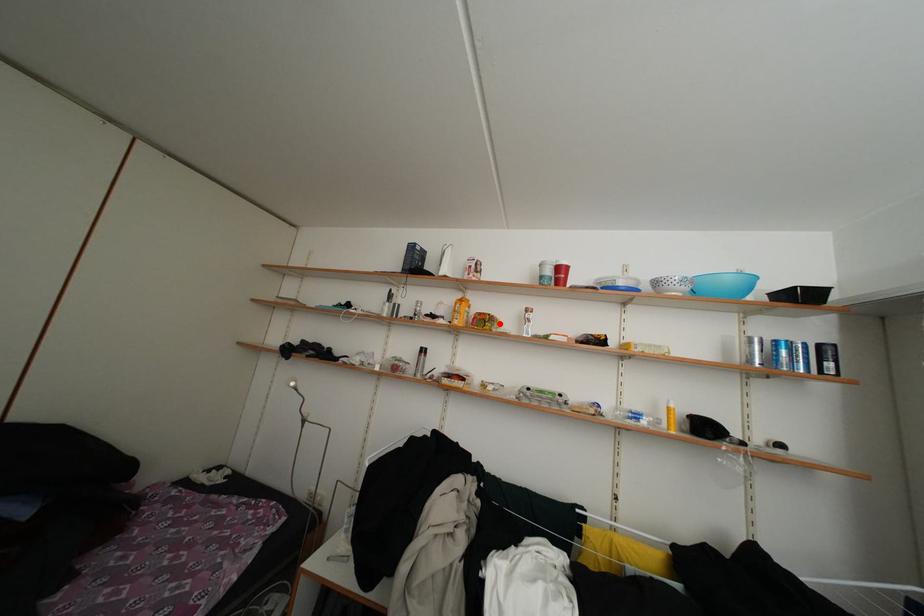
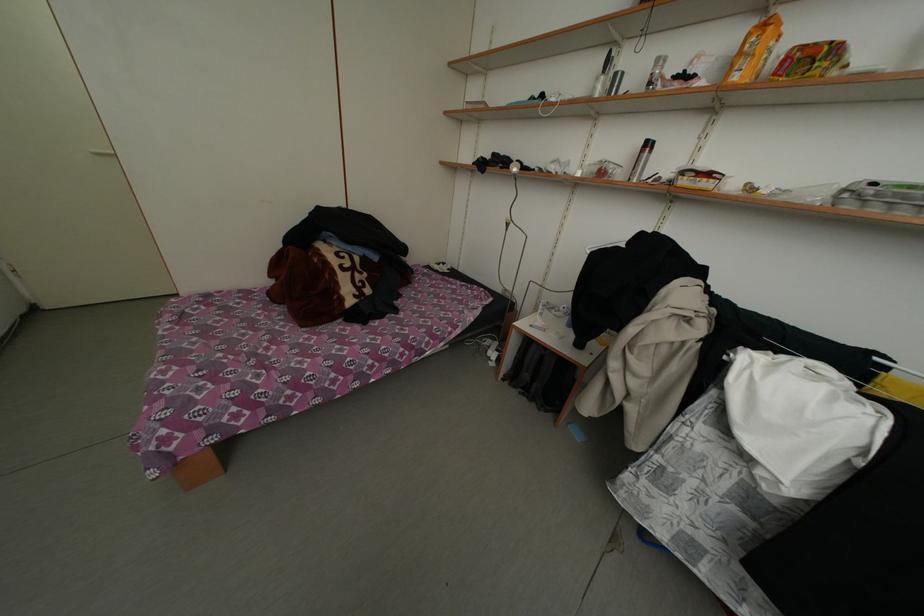
Question: I am providing you with two images of the same scene from different viewpoints. In image1, a red point is highlighted. Considering the same 3D point in image2, which of the following is correct?

Choices:
 (A) It is closer
 (B) It is farther

Answer: (B)